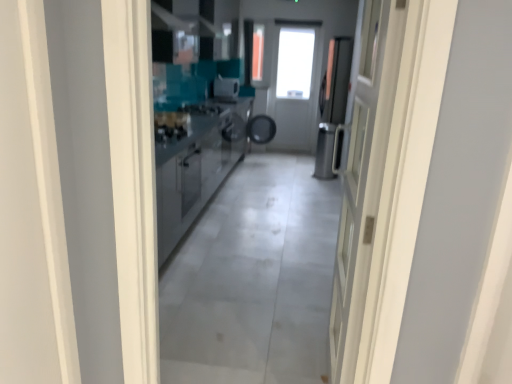
Question: In terms of size, does white glossy door at right appear bigger or smaller than satin silver toaster at center?

Choices:
 (A) small
 (B) big

Answer: (B)

Question: From a real-world perspective, is white glossy door at right positioned above or below satin silver toaster at center?

Choices:
 (A) below
 (B) above

Answer: (A)

Question: Which is nearer to the satin silver dishwasher at center?

Choices:
 (A) stainless steel cabinetry at center
 (B) white glossy door at right
 (C) satin silver toaster at center

Answer: (C)

Question: Based on their relative distances, which object is farther from the satin silver toaster at center?

Choices:
 (A) satin silver dishwasher at center
 (B) stainless steel cabinetry at center
 (C) white glossy door at right

Answer: (C)